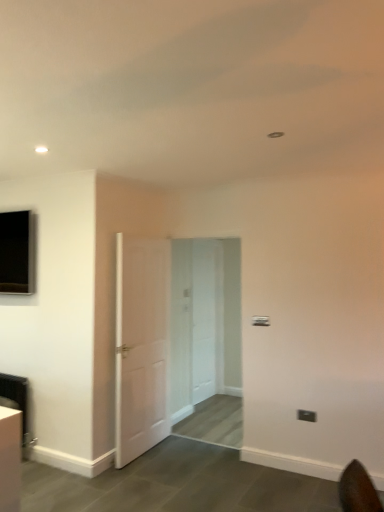
Question: Can you confirm if black plastic electric outlet at lower right is wider than white wooden door at center, marked as the 1th door in a right-to-left arrangement?

Choices:
 (A) yes
 (B) no

Answer: (B)

Question: From the image's perspective, is black plastic electric outlet at lower right located above white wooden door at center, marked as the 2th door in a left-to-right arrangement?

Choices:
 (A) no
 (B) yes

Answer: (A)

Question: Considering the relative sizes of black plastic electric outlet at lower right and white wooden door at center, marked as the 2th door in a left-to-right arrangement, in the image provided, is black plastic electric outlet at lower right thinner than white wooden door at center, marked as the 2th door in a left-to-right arrangement,?

Choices:
 (A) yes
 (B) no

Answer: (A)

Question: Is black plastic electric outlet at lower right shorter than white wooden door at center, marked as the 1th door in a right-to-left arrangement?

Choices:
 (A) yes
 (B) no

Answer: (A)

Question: From the image's perspective, is black plastic electric outlet at lower right under white wooden door at center, which appears as the first door when viewed from the back?

Choices:
 (A) no
 (B) yes

Answer: (B)

Question: From a real-world perspective, is white wooden door at center, arranged as the 2th door when viewed from the front, positioned above or below white matte door at center, which is the 1th door from left to right?

Choices:
 (A) above
 (B) below

Answer: (A)

Question: Looking at their shapes, would you say white wooden door at center, which appears as the first door when viewed from the back, is wider or thinner than white matte door at center, arranged as the second door when viewed from the right?

Choices:
 (A) wide
 (B) thin

Answer: (B)

Question: From the image's perspective, is white wooden door at center, marked as the 1th door in a right-to-left arrangement, above or below white matte door at center, the 2th door viewed from the back?

Choices:
 (A) above
 (B) below

Answer: (B)

Question: In the image, is white wooden door at center, marked as the 2th door in a left-to-right arrangement, positioned in front of or behind white matte door at center, marked as the 1th door in a front-to-back arrangement?

Choices:
 (A) behind
 (B) front

Answer: (A)

Question: Visually, is black plastic electric outlet at lower right positioned to the left or to the right of white matte door at center, marked as the 1th door in a front-to-back arrangement?

Choices:
 (A) right
 (B) left

Answer: (A)

Question: Is black plastic electric outlet at lower right in front of or behind white matte door at center, the 2th door viewed from the back, in the image?

Choices:
 (A) front
 (B) behind

Answer: (A)

Question: Looking at the image, does black plastic electric outlet at lower right seem bigger or smaller compared to white matte door at center, marked as the 1th door in a front-to-back arrangement?

Choices:
 (A) big
 (B) small

Answer: (B)

Question: From the image's perspective, is black plastic electric outlet at lower right positioned above or below white matte door at center, the 2th door viewed from the back?

Choices:
 (A) above
 (B) below

Answer: (B)

Question: From a real-world perspective, is black glass window at upper left physically located above or below white wooden door at center, marked as the 2th door in a left-to-right arrangement?

Choices:
 (A) below
 (B) above

Answer: (B)

Question: Looking at their shapes, would you say black glass window at upper left is wider or thinner than white wooden door at center, arranged as the 2th door when viewed from the front?

Choices:
 (A) wide
 (B) thin

Answer: (A)